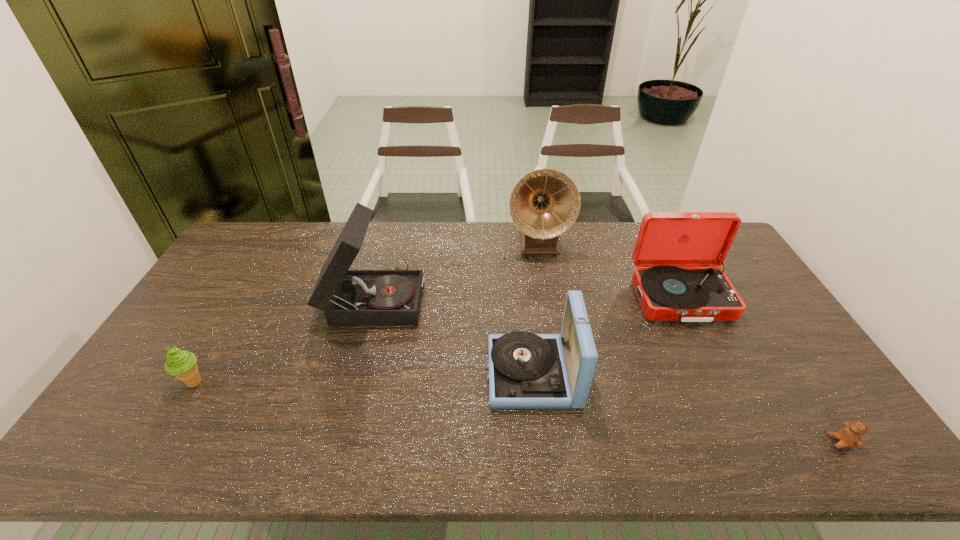
The width and height of the screenshot is (960, 540). I want to click on empty space between the third shortest object and the rightmost phonograph record, so click(x=606, y=335).

Find the location of a particular element. The width and height of the screenshot is (960, 540). vacant space in between the nearest phonograph record and the fifth tallest object is located at coordinates (363, 377).

At what (x,y) coordinates should I click in order to perform the action: click on unoccupied area between the third tallest phonograph record and the shortest object. Please return your answer as a coordinate pair (x, y). Looking at the image, I should click on (760, 370).

Where is `free space between the farthest object and the leftmost phonograph record`? The width and height of the screenshot is (960, 540). free space between the farthest object and the leftmost phonograph record is located at coordinates (456, 271).

Identify the location of vacant area between the third tallest phonograph record and the nearest phonograph record. This screenshot has width=960, height=540. (606, 335).

The height and width of the screenshot is (540, 960). In order to click on vacant space that's between the nearest object and the icecream in this screenshot , I will do `click(517, 412)`.

Identify the location of free space between the leftmost phonograph record and the farthest object. The height and width of the screenshot is (540, 960). (456, 271).

Locate an element on the screen. The image size is (960, 540). empty space that is in between the leftmost object and the shortest phonograph record is located at coordinates (363, 377).

Where is `object that is the fifth closest to the shortest phonograph record`? This screenshot has height=540, width=960. object that is the fifth closest to the shortest phonograph record is located at coordinates (182, 364).

This screenshot has width=960, height=540. Find the location of `object that is the third closest to the icecream`. object that is the third closest to the icecream is located at coordinates (545, 203).